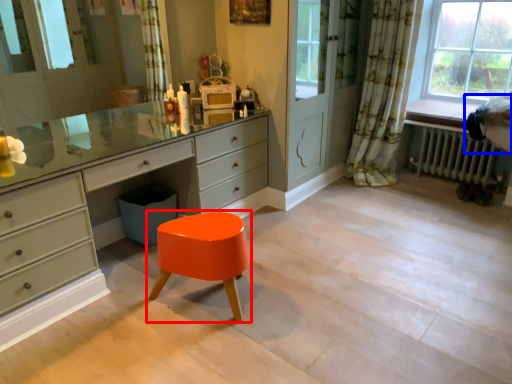
Question: Among these objects, which one is farthest to the camera, stool (highlighted by a red box) or swivel chair (highlighted by a blue box)?

Choices:
 (A) stool
 (B) swivel chair

Answer: (B)